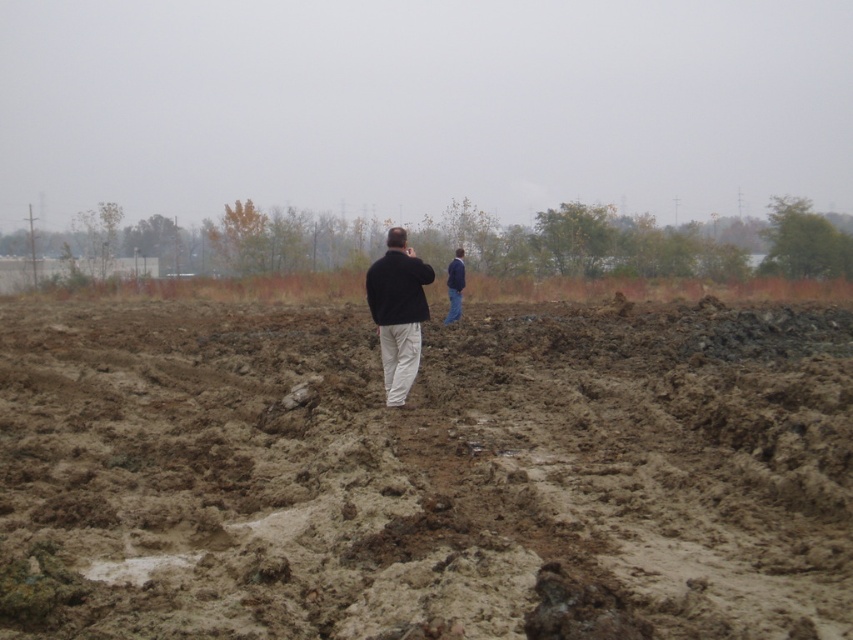
Question: Based on their relative distances, which object is farther from the blue denim jacket at center?

Choices:
 (A) matte black jacket at center
 (B) brown muddy field at center

Answer: (A)

Question: Among these points, which one is farthest from the camera?

Choices:
 (A) (459, 280)
 (B) (757, 348)
 (C) (407, 282)

Answer: (A)

Question: Does brown muddy field at center have a smaller size compared to blue denim jacket at center?

Choices:
 (A) yes
 (B) no

Answer: (B)

Question: Is brown muddy field at center below matte black jacket at center?

Choices:
 (A) yes
 (B) no

Answer: (A)

Question: Is brown muddy field at center bigger than matte black jacket at center?

Choices:
 (A) no
 (B) yes

Answer: (B)

Question: Which point appears farthest from the camera in this image?

Choices:
 (A) (547, 428)
 (B) (419, 307)
 (C) (462, 257)

Answer: (C)